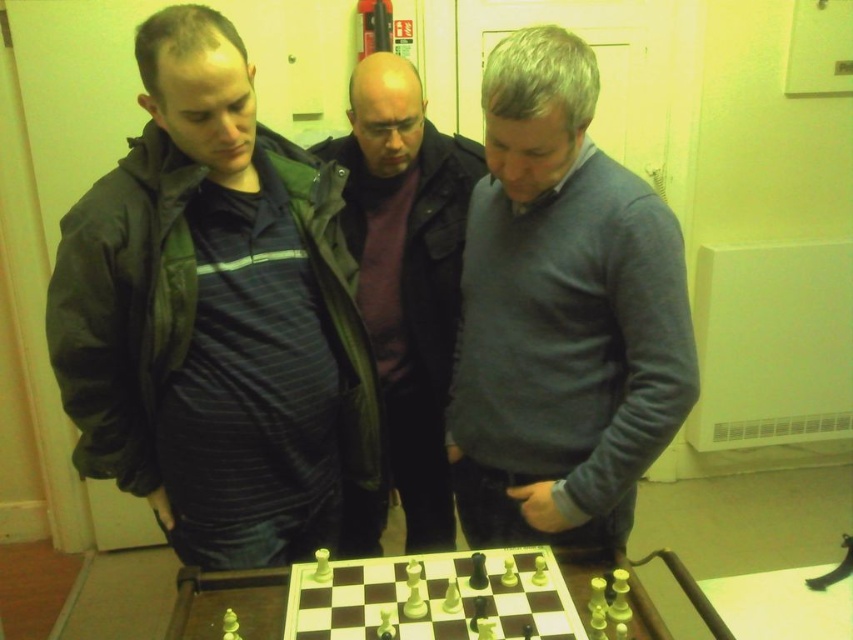
Question: Among these objects, which one is nearest to the camera?

Choices:
 (A) wooden chessboard at center
 (B) gray sweater at center
 (C) dark green jacket at left

Answer: (A)

Question: In this image, where is gray sweater at center located relative to wooden chessboard at center?

Choices:
 (A) above
 (B) below

Answer: (A)

Question: Which of the following is the closest to the observer?

Choices:
 (A) dark gray jacket at center
 (B) gray sweater at center
 (C) dark green jacket at left

Answer: (B)

Question: Is the position of dark green jacket at left less distant than that of gray sweater at center?

Choices:
 (A) no
 (B) yes

Answer: (A)

Question: Which object is farther from the camera taking this photo?

Choices:
 (A) dark gray jacket at center
 (B) wooden chessboard at center

Answer: (A)

Question: Considering the relative positions of dark green jacket at left and gray sweater at center in the image provided, where is dark green jacket at left located with respect to gray sweater at center?

Choices:
 (A) left
 (B) right

Answer: (A)